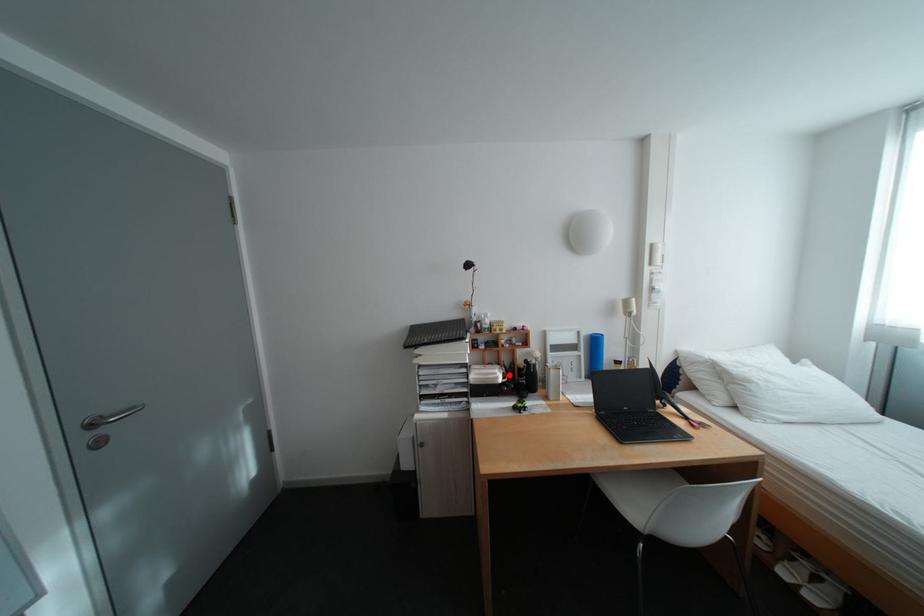
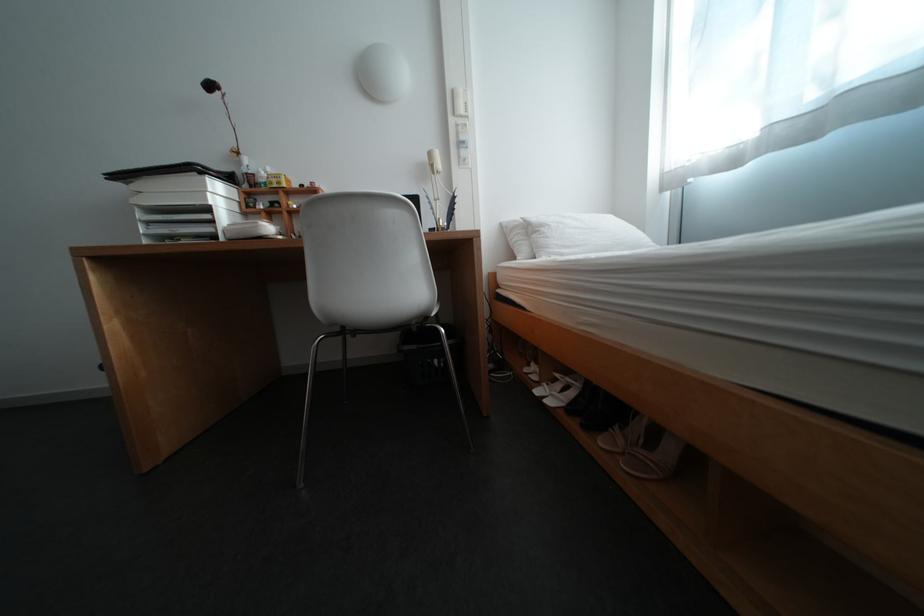
In the second image, find the point that corresponds to the highlighted location in the first image.

(270, 224)